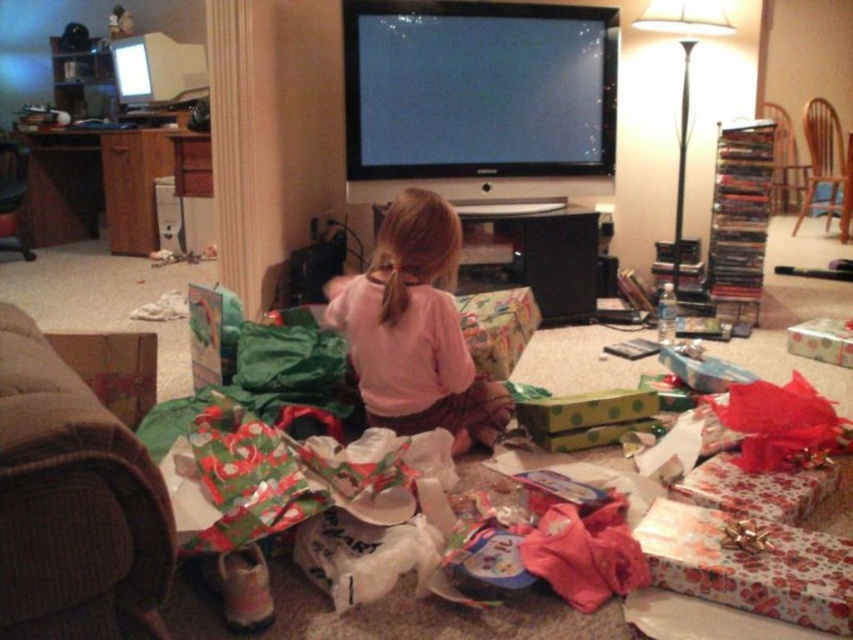
Question: Considering the real-world distances, which object is closest to the brown wooden chair at upper right?

Choices:
 (A) brown wood chair at upper right
 (B) pink cotton shirt at center

Answer: (A)

Question: Considering the relative positions of brown fabric couch at left and pink cotton shirt at center in the image provided, where is brown fabric couch at left located with respect to pink cotton shirt at center?

Choices:
 (A) right
 (B) left

Answer: (B)

Question: Which point appears closest to the camera in this image?

Choices:
 (A) (790, 163)
 (B) (469, 419)
 (C) (828, 163)

Answer: (B)

Question: Does brown fabric armchair at left have a lesser width compared to brown wood chair at upper right?

Choices:
 (A) yes
 (B) no

Answer: (A)

Question: Which object is closer to the camera taking this photo?

Choices:
 (A) brown fabric armchair at left
 (B) brown wooden chair at upper right

Answer: (A)

Question: Can you confirm if brown fabric armchair at left is smaller than brown wood chair at upper right?

Choices:
 (A) no
 (B) yes

Answer: (B)